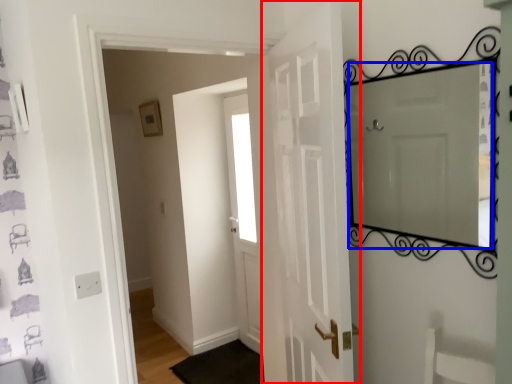
Question: Which object is further to the camera taking this photo, door (highlighted by a red box) or mirror (highlighted by a blue box)?

Choices:
 (A) door
 (B) mirror

Answer: (B)